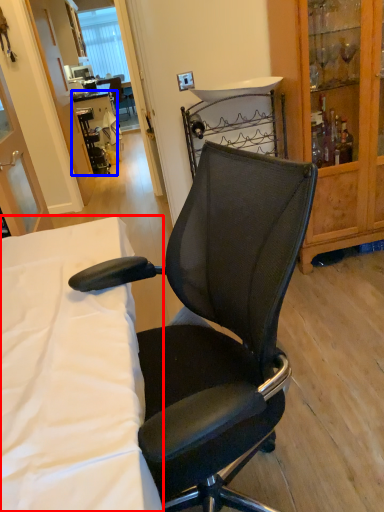
Question: Which of the following is the closest to the observer, desk (highlighted by a red box) or table (highlighted by a blue box)?

Choices:
 (A) desk
 (B) table

Answer: (A)